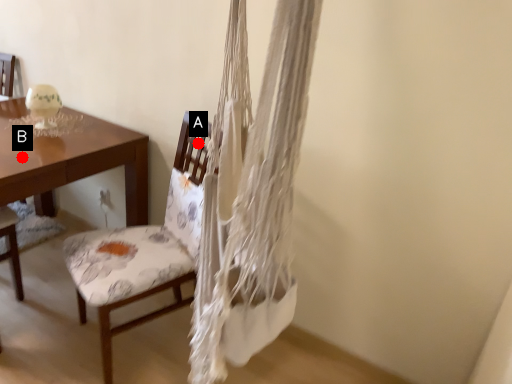
Question: Two points are circled on the image, labeled by A and B beside each circle. Which of the following is the farthest from the observer?

Choices:
 (A) A is further
 (B) B is further

Answer: (A)